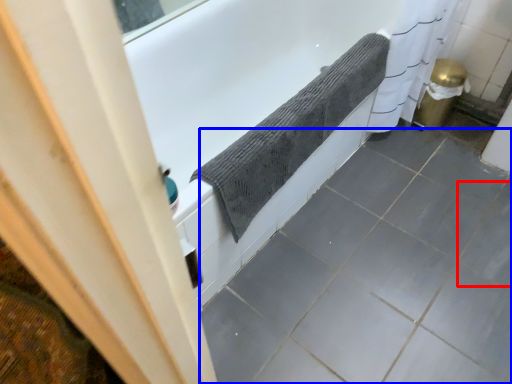
Question: Which object is closer to the camera taking this photo, ceramic tile (highlighted by a red box) or ceramic tile (highlighted by a blue box)?

Choices:
 (A) ceramic tile
 (B) ceramic tile

Answer: (B)